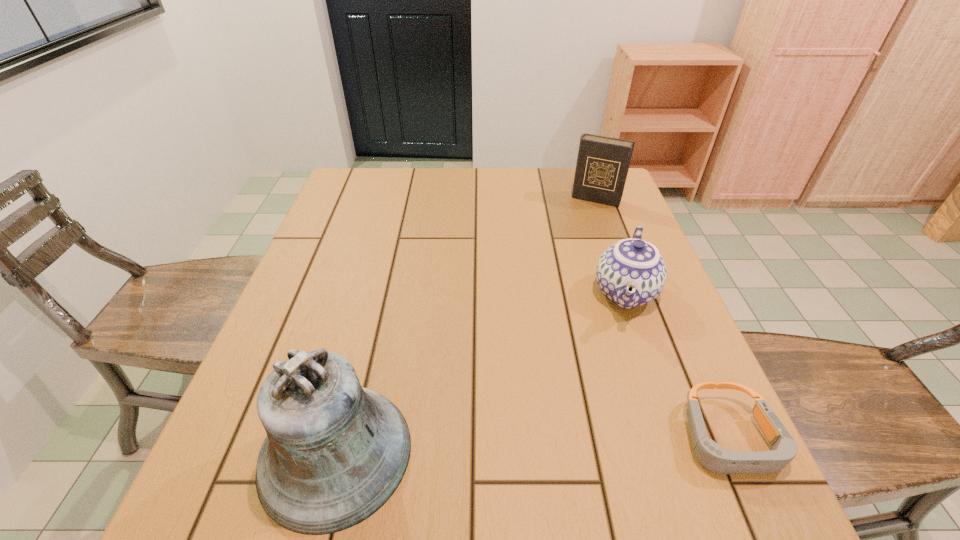
Where is `vacant region located 0.300m from the spout of the chinaware`? vacant region located 0.300m from the spout of the chinaware is located at coordinates (599, 451).

This screenshot has height=540, width=960. In order to click on free space located on the front cover of the third shortest object in this screenshot , I will do `click(575, 241)`.

Find the location of a particular element. The height and width of the screenshot is (540, 960). free region located on the front cover of the third shortest object is located at coordinates (585, 219).

What are the coordinates of `free space located on the front cover of the third shortest object` in the screenshot? It's located at (581, 229).

Where is `object at the far edge`? object at the far edge is located at coordinates (602, 166).

Identify the location of bell positioned at the near edge. (335, 452).

This screenshot has width=960, height=540. Find the location of `goggles that is at the near edge`. goggles that is at the near edge is located at coordinates 712,456.

The width and height of the screenshot is (960, 540). I want to click on object present at the left edge, so click(335, 452).

Where is `goggles present at the right edge`? Image resolution: width=960 pixels, height=540 pixels. goggles present at the right edge is located at coordinates (712, 456).

Where is `chinaware that is positioned at the right edge`? The image size is (960, 540). chinaware that is positioned at the right edge is located at coordinates (630, 273).